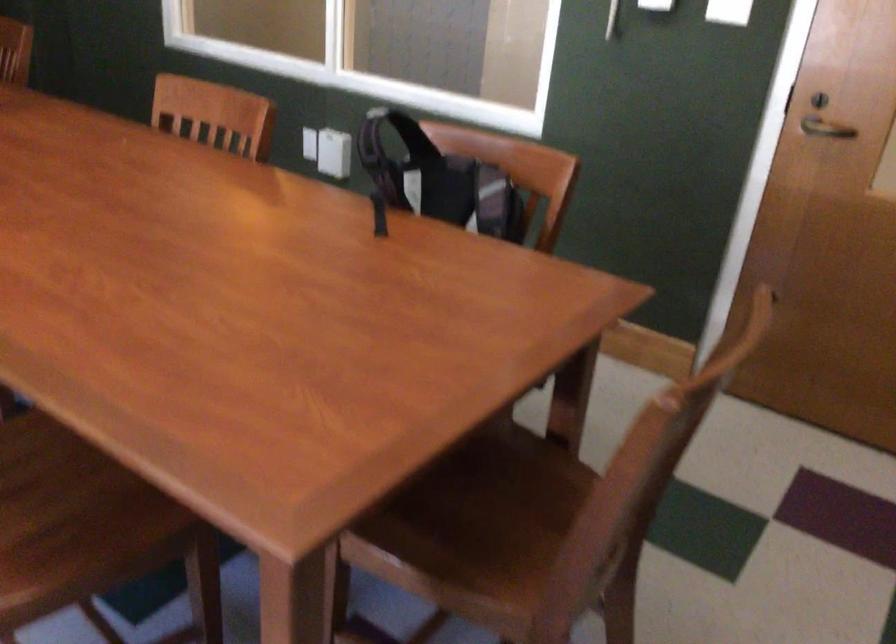
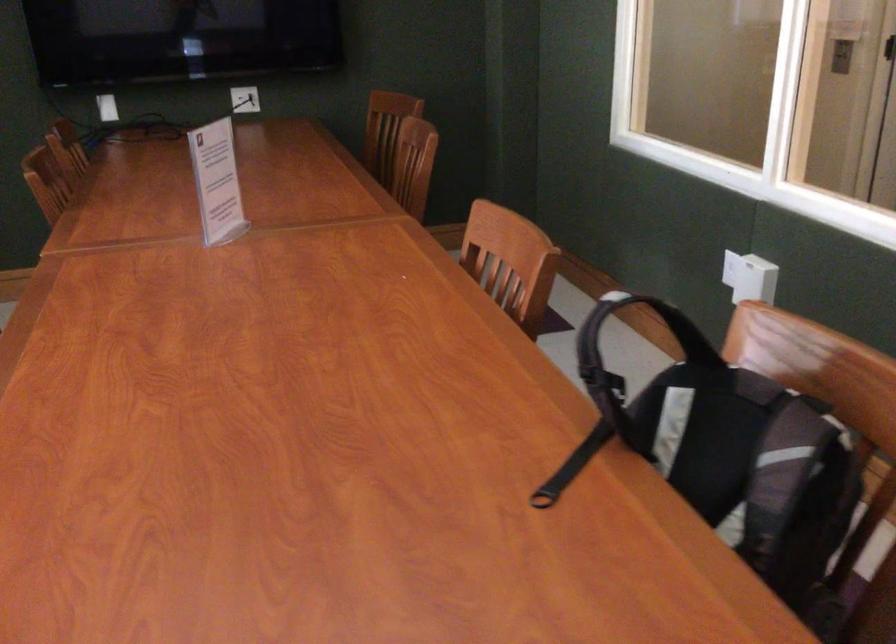
Where in the second image is the point corresponding to (376,221) from the first image?

(572, 466)